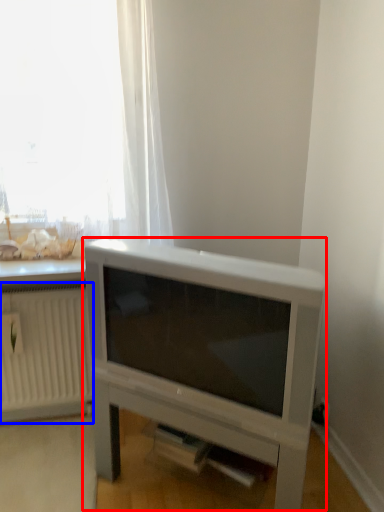
Question: Which object is closer to the camera taking this photo, entertainment center (highlighted by a red box) or radiator (highlighted by a blue box)?

Choices:
 (A) entertainment center
 (B) radiator

Answer: (A)